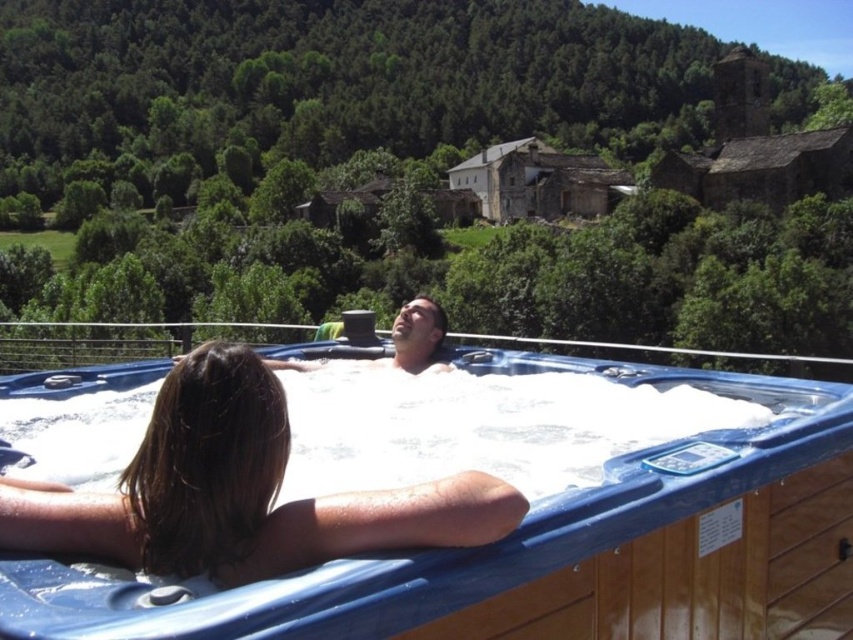
Is blue plastic hot tub at center taller than matte blue hot tub at center?

Yes.

Which is behind, point (424, 616) or point (424, 349)?

The point (424, 349) is more distant.

I want to click on blue plastic hot tub at center, so click(469, 548).

Can you confirm if white foamy water at center is positioned to the left of matte blue hot tub at center?

In fact, white foamy water at center is to the right of matte blue hot tub at center.

Between point (78, 480) and point (395, 321), which one is positioned in front?

Point (78, 480)

Locate an element on the screen. The width and height of the screenshot is (853, 640). white foamy water at center is located at coordinates click(x=483, y=426).

Is blue plastic hot tub at center shorter than white foamy water at center?

Incorrect, blue plastic hot tub at center's height does not fall short of white foamy water at center's.

Who is positioned more to the left, blue plastic hot tub at center or white foamy water at center?

blue plastic hot tub at center

Which is in front, point (450, 564) or point (508, 424)?

Positioned in front is point (450, 564).

The height and width of the screenshot is (640, 853). I want to click on blue plastic hot tub at center, so click(x=469, y=548).